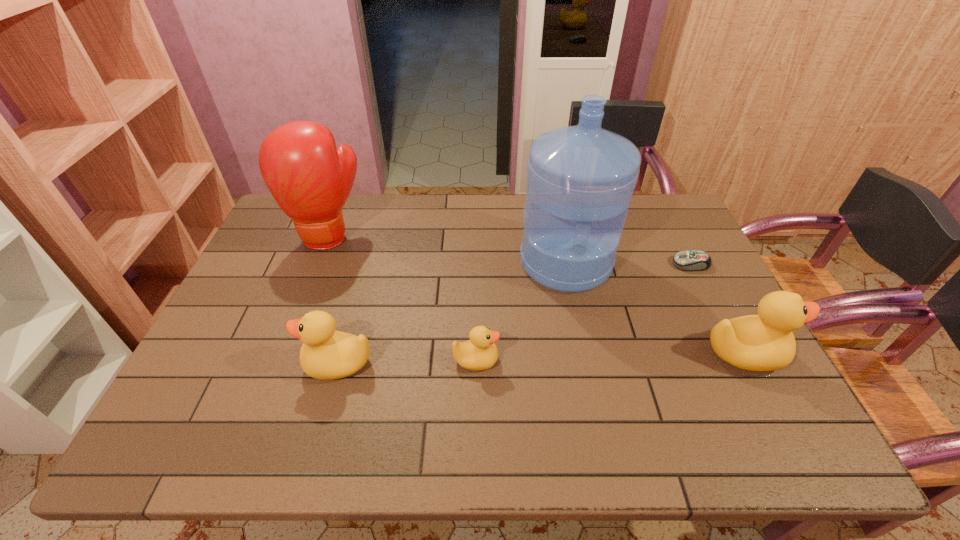
Where is `object that is at the left edge`? object that is at the left edge is located at coordinates (310, 180).

Find the location of a particular element. duck at the right edge is located at coordinates [765, 342].

Where is `computer mouse that is at the right edge`? This screenshot has height=540, width=960. computer mouse that is at the right edge is located at coordinates (692, 260).

Identify the location of object present at the far left corner. (310, 180).

Locate an element on the screen. Image resolution: width=960 pixels, height=540 pixels. object situated at the near right corner is located at coordinates (765, 342).

You are a GUI agent. You are given a task and a screenshot of the screen. Output one action in this format:
    pyautogui.click(x=<x>, y=<y>)
    Task: Click on the vacant space at the far edge of the desktop
    
    Given the screenshot: What is the action you would take?
    pyautogui.click(x=425, y=197)

Where is `vacant region at the near edge of the desktop`? vacant region at the near edge of the desktop is located at coordinates (503, 397).

This screenshot has width=960, height=540. Identify the location of free region at the left edge. (259, 315).

You are a GUI agent. You are given a task and a screenshot of the screen. Output one action in this format:
    pyautogui.click(x=<x>, y=<y>)
    Task: Click on the free region at the right edge of the desktop
    
    Given the screenshot: What is the action you would take?
    [668, 286]

In the image, there is a desktop. Find the location of `vacant space at the far right corner`. vacant space at the far right corner is located at coordinates (679, 208).